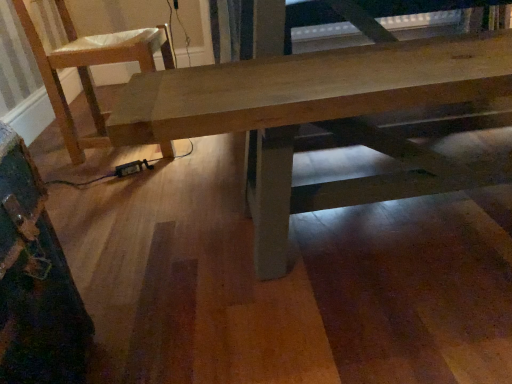
Image resolution: width=512 pixels, height=384 pixels. Describe the element at coordinates (89, 66) in the screenshot. I see `light brown wood chair at upper left` at that location.

In order to face light brown wood chair at upper left, should I rotate leftwards or rightwards?

To face it directly, rotate left by 19.175 degrees.

Find the location of a particular element. light brown wood chair at upper left is located at coordinates (89, 66).

Locate an element on the screen. The image size is (512, 384). wooden table at center is located at coordinates (303, 105).

What do you see at coordinates (303, 105) in the screenshot? I see `wooden table at center` at bounding box center [303, 105].

Locate an element on the screen. The height and width of the screenshot is (384, 512). light brown wood chair at upper left is located at coordinates (89, 66).

Consider the image. Is light brown wood chair at upper left to the left of wooden table at center from the viewer's perspective?

Yes, light brown wood chair at upper left is to the left of wooden table at center.

Is light brown wood chair at upper left closer to the viewer compared to wooden table at center?

No, light brown wood chair at upper left is further to the viewer.

Considering the points (85, 54) and (287, 128), which point is behind, point (85, 54) or point (287, 128)?

Point (85, 54)

From the image's perspective, is light brown wood chair at upper left under wooden table at center?

Incorrect, from the image's perspective, light brown wood chair at upper left is higher than wooden table at center.

From a real-world perspective, who is located lower, light brown wood chair at upper left or wooden table at center?

wooden table at center.

Does light brown wood chair at upper left have a greater width compared to wooden table at center?

Correct, the width of light brown wood chair at upper left exceeds that of wooden table at center.

Is light brown wood chair at upper left shorter than wooden table at center?

No.

Does light brown wood chair at upper left have a smaller size compared to wooden table at center?

Correct, light brown wood chair at upper left occupies less space than wooden table at center.

Would you say light brown wood chair at upper left is outside wooden table at center?

Yes, light brown wood chair at upper left is not within wooden table at center.

Is there a large distance between light brown wood chair at upper left and wooden table at center?

No.

Is light brown wood chair at upper left facing towards wooden table at center?

No, light brown wood chair at upper left is not facing towards wooden table at center.

How many degrees apart are the facing directions of light brown wood chair at upper left and wooden table at center?

light brown wood chair at upper left and wooden table at center are facing 95.7 degrees away from each other.

Identify the location of table below the light brown wood chair at upper left (from the image's perspective). This screenshot has width=512, height=384. (303, 105).

Visually, is wooden table at center positioned to the left or to the right of light brown wood chair at upper left?

wooden table at center is positioned on light brown wood chair at upper left's right side.

Does wooden table at center lie behind light brown wood chair at upper left?

No, it is not.

Does point (135, 138) appear closer or farther from the camera than point (51, 68)?

Point (135, 138).

From the image's perspective, is wooden table at center above or below light brown wood chair at upper left?

From the image's perspective, wooden table at center appears below light brown wood chair at upper left.

From a real-world perspective, is wooden table at center physically below light brown wood chair at upper left?

Yes, from a real-world perspective, wooden table at center is beneath light brown wood chair at upper left.

Looking at their sizes, would you say wooden table at center is wider or thinner than light brown wood chair at upper left?

Considering their sizes, wooden table at center looks slimmer than light brown wood chair at upper left.

Looking at this image, can you confirm if wooden table at center is shorter than light brown wood chair at upper left?

Indeed, wooden table at center has a lesser height compared to light brown wood chair at upper left.

Considering the sizes of objects wooden table at center and light brown wood chair at upper left in the image provided, who is smaller, wooden table at center or light brown wood chair at upper left?

light brown wood chair at upper left is smaller.

Would you say wooden table at center contains light brown wood chair at upper left?

No, wooden table at center does not contain light brown wood chair at upper left.

Is the surface of wooden table at center in direct contact with light brown wood chair at upper left?

wooden table at center and light brown wood chair at upper left are not in contact.

Consider the image. Is wooden table at center positioned with its back to light brown wood chair at upper left?

No, wooden table at center's orientation is not away from light brown wood chair at upper left.

How different are the orientations of wooden table at center and light brown wood chair at upper left in degrees?

95.7 degrees.

In the image, there is a light brown wood chair at upper left. Where is `table below it (from the image's perspective)`? This screenshot has height=384, width=512. table below it (from the image's perspective) is located at coordinates (303, 105).

Identify the location of chair behind the wooden table at center. Image resolution: width=512 pixels, height=384 pixels. (89, 66).

Where is `table below the light brown wood chair at upper left (from the image's perspective)`? This screenshot has height=384, width=512. table below the light brown wood chair at upper left (from the image's perspective) is located at coordinates click(x=303, y=105).